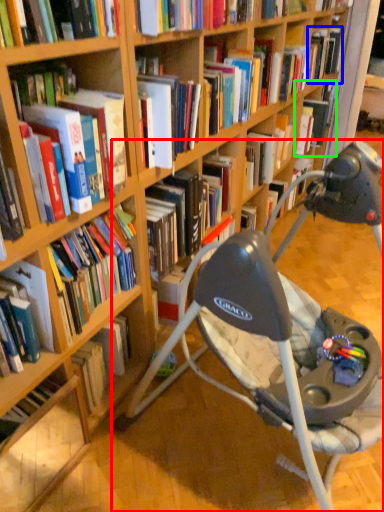
Question: Which is farther away from chair (highlighted by a red box)? book (highlighted by a blue box) or book (highlighted by a green box)?

Choices:
 (A) book
 (B) book

Answer: (A)